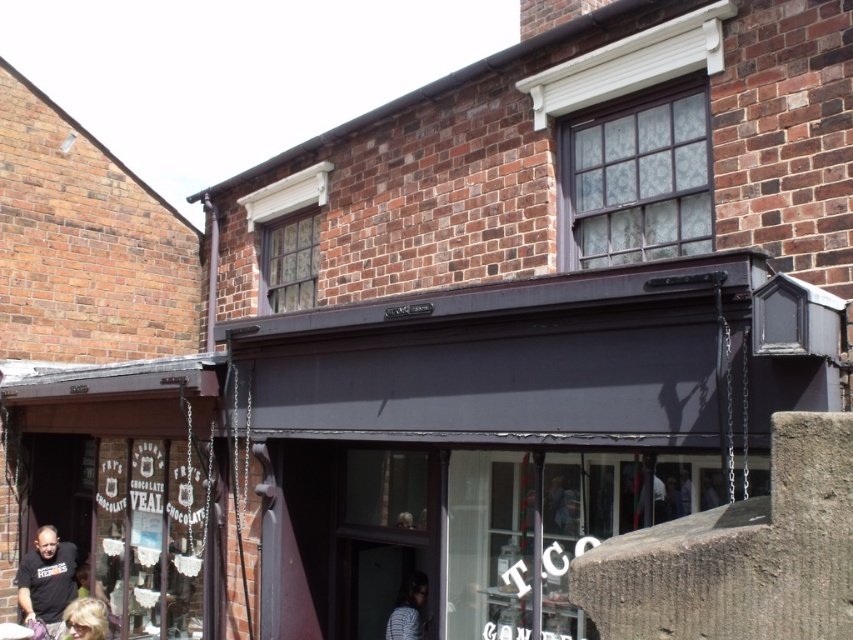
You are standing at the corner of the brick building and see two points marked in the image. Which point is closer to you, point [19,602] or point [96,621]?

Point [96,621] is closer to you because it is in front of point [19,602].

You are standing at the entrance of the brick building and see two points marked on the wall. One is at point (x=41, y=552) and the other at point (x=410, y=627). Which point is closer to you?

Point (x=410, y=627) is closer to you because it is in front of point (x=41, y=552).